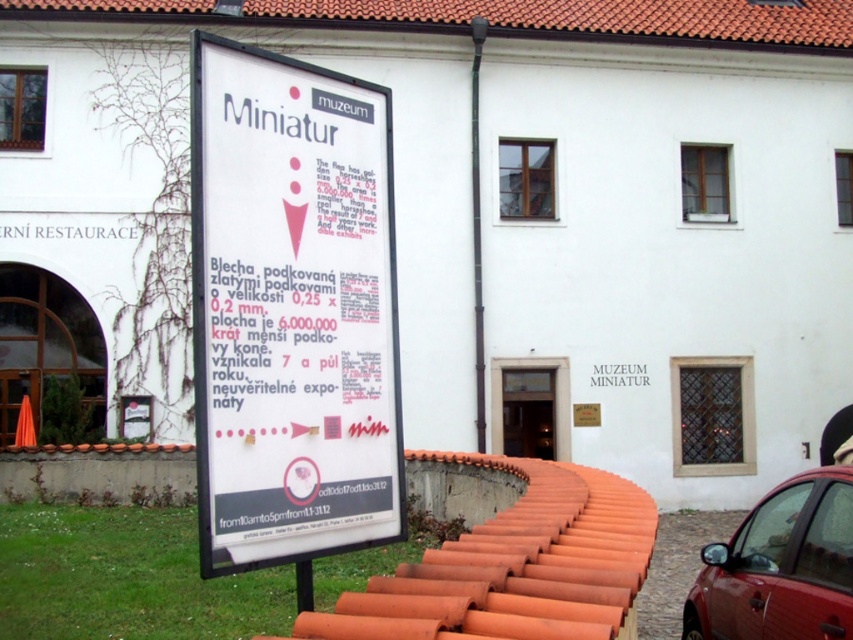
In the scene shown: You are standing in front of the MUZEUM MINIATUR and looking at the signboard. There are two points marked on the signboard at coordinates point (x=375, y=221) and point (x=718, y=586). Which point is closer to your eyes?

Point (x=375, y=221) is closer to the camera than point (x=718, y=586), so the point closer to your eyes is point (x=375, y=221).

You are a visitor at the MUZEUM MINIATUR and want to take a photo of both the white paper sign at center and the shiny red car at lower right. Since you want both objects in focus, you need to know their heights. Which object is taller?

The white paper sign at center is taller than the shiny red car at lower right.

You are standing at the entrance of the MUZEUM MINIATUR and want to read the white paper sign at center. The shiny red car at lower right is blocking your view. Can you step aside to get a clear view of the sign without moving the car?

The white paper sign at center is 11.47 feet away from the shiny red car at lower right. Since the distance between them is significant, you can easily step aside to the left or right to get a clear view of the sign without moving the car.